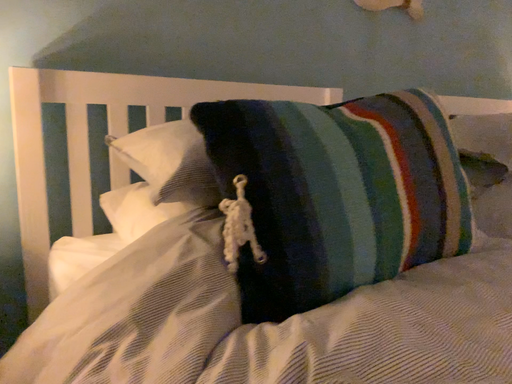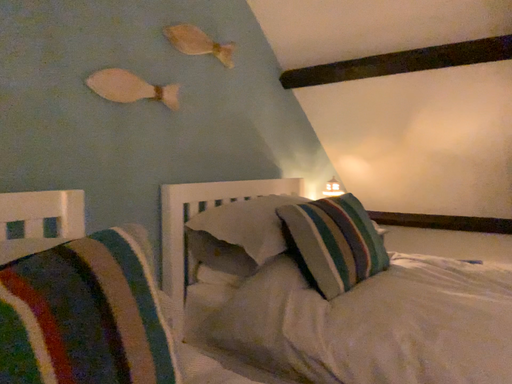
Question: How did the camera likely rotate when shooting the video?

Choices:
 (A) rotated downward
 (B) rotated upward

Answer: (B)